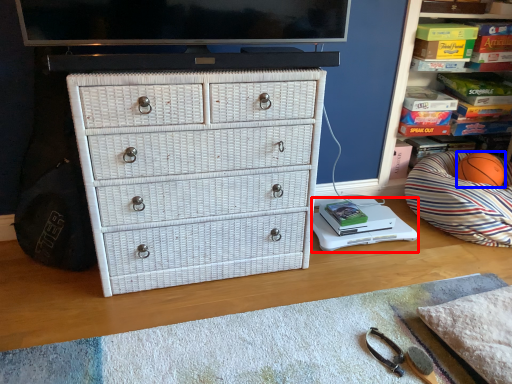
Question: Which point is closer to the camera, changing table (highlighted by a red box) or basketball (highlighted by a blue box)?

Choices:
 (A) changing table
 (B) basketball

Answer: (A)